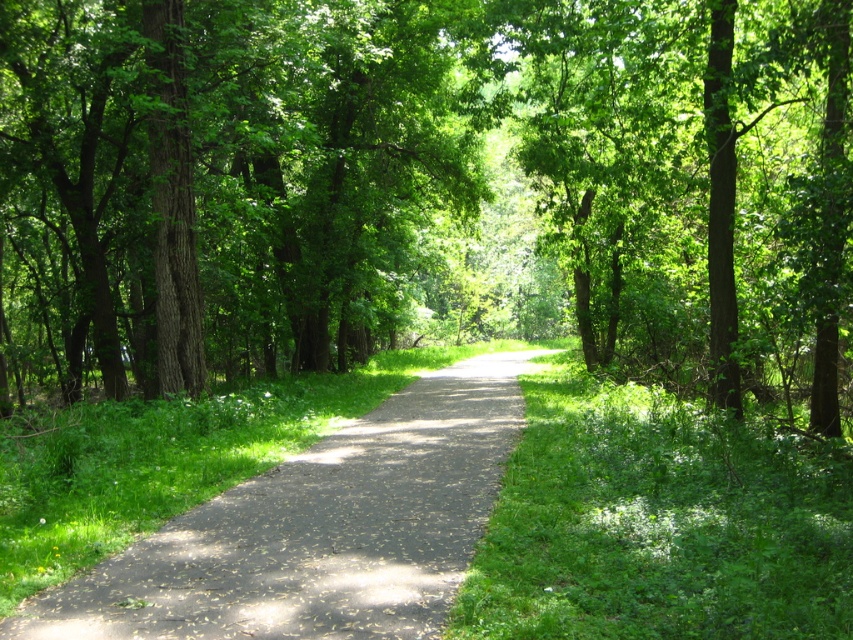
You are a hiker walking along the dark gray asphalt path at center and want to rest under the green leafy tree at center. Which direction should you walk to reach the tree?

The green leafy tree at center is positioned on the left side of dark gray asphalt path at center, so you should walk to the left to reach the tree.

You are standing on a forest path and want to reach a specific point marked at coordinates point (788, 216). If you can walk 4 feet per second, how long will it take you to reach that point?

The point (788, 216) is 38.19 feet away from the viewer. At a walking speed of 4 feet per second, it will take approximately 9.55 seconds to reach the point.

You are standing at the start of the forest path and want to take a photo of the green leafy tree at center. If your camera can focus up to 10 meters away, will it be able to capture the tree clearly?

The green leafy tree at center is 10.29 meters away from the camera. Since the camera can only focus up to 10 meters, it will not be able to capture the tree clearly.